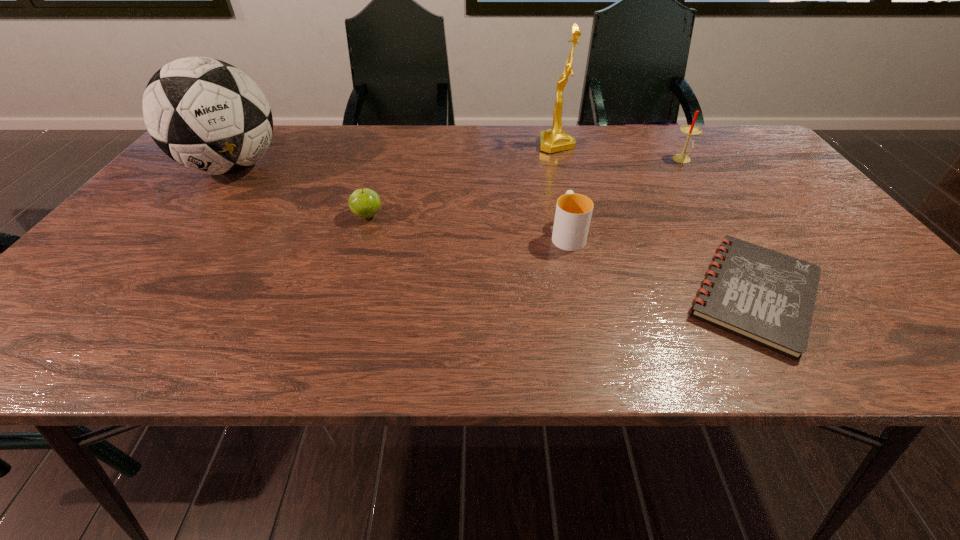
The image size is (960, 540). I want to click on award, so click(x=555, y=139).

The width and height of the screenshot is (960, 540). I want to click on soccer ball, so click(x=207, y=115).

I want to click on the third tallest object, so pos(690,130).

Identify the location of the third shortest object. This screenshot has height=540, width=960. (573, 213).

What are the coordinates of `the second shortest object` in the screenshot? It's located at (365, 203).

The width and height of the screenshot is (960, 540). I want to click on the fifth object from right to left, so click(365, 203).

The width and height of the screenshot is (960, 540). Find the location of `notebook`. notebook is located at coordinates (761, 295).

Locate an element on the screen. The width and height of the screenshot is (960, 540). free spot located on the front-facing side of the award is located at coordinates (435, 145).

The image size is (960, 540). What are the coordinates of `vacant space located 0.180m on the front-facing side of the award` in the screenshot? It's located at (478, 145).

I want to click on vacant space located on the front-facing side of the award, so click(489, 145).